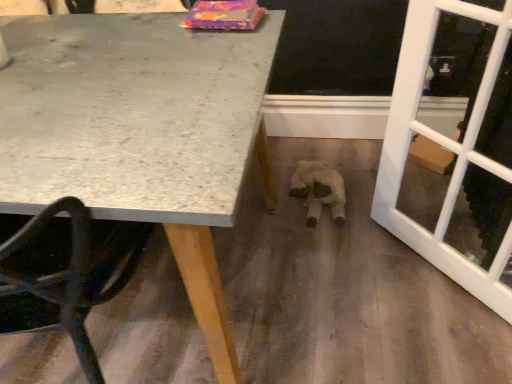
Locate an element on the screen. This screenshot has height=384, width=512. vacant area in front of white plush toy at center is located at coordinates (326, 244).